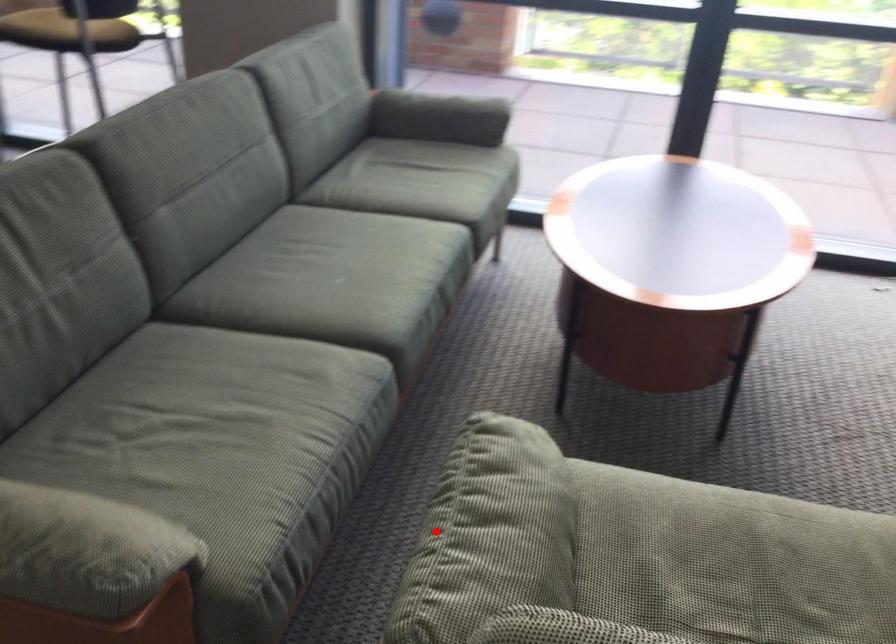
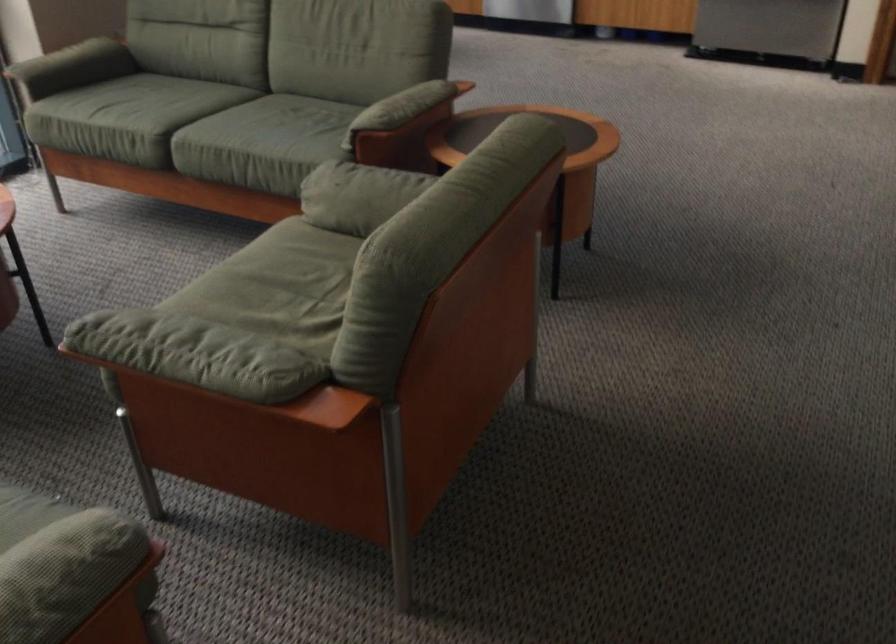
The point at the highlighted location is marked in the first image. Where is the corresponding point in the second image?

(195, 354)